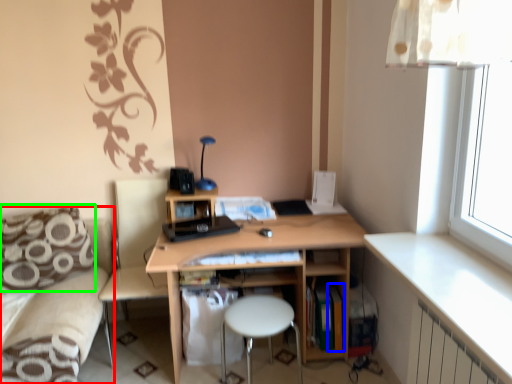
Question: Which is nearer to the couch (highlighted by a red box)? book (highlighted by a blue box) or pillow (highlighted by a green box).

Choices:
 (A) book
 (B) pillow

Answer: (B)